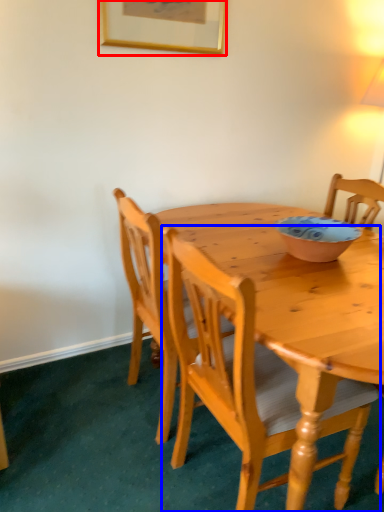
Question: Which object appears farthest to the camera in this image, picture frame (highlighted by a red box) or chair (highlighted by a blue box)?

Choices:
 (A) picture frame
 (B) chair

Answer: (A)